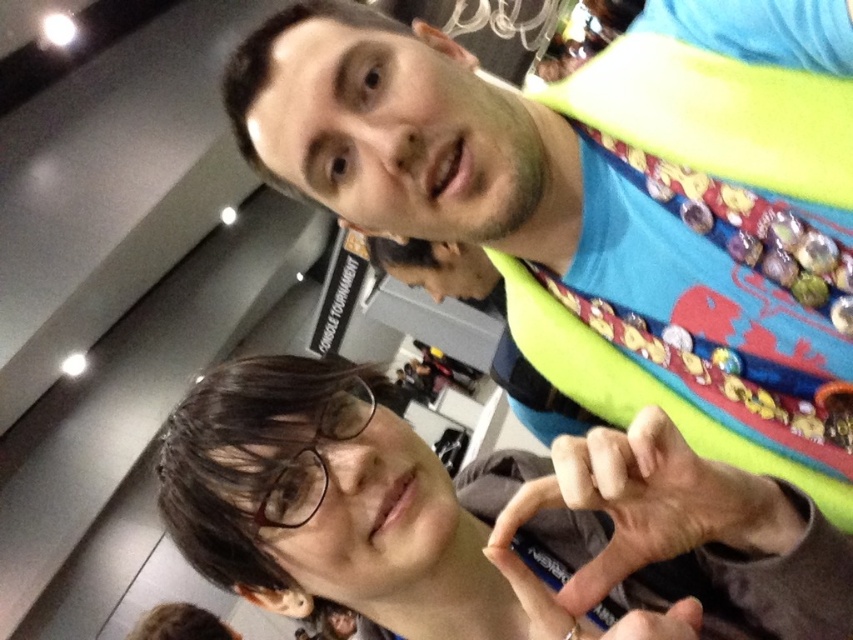
Question: Which of the following is the farthest from the observer?

Choices:
 (A) brown matte glasses at lower left
 (B) matte black pen at center
 (C) matte blue shirt at upper center

Answer: (C)

Question: Is matte blue shirt at upper center to the left of brown matte glasses at lower left from the viewer's perspective?

Choices:
 (A) yes
 (B) no

Answer: (B)

Question: Is brown matte glasses at lower left wider than matte black pen at center?

Choices:
 (A) yes
 (B) no

Answer: (A)

Question: Which object is positioned farthest from the brown matte glasses at lower left?

Choices:
 (A) matte blue shirt at upper center
 (B) matte black pen at center

Answer: (A)

Question: Does brown matte glasses at lower left appear under matte black pen at center?

Choices:
 (A) no
 (B) yes

Answer: (B)

Question: Which point is closer to the camera?

Choices:
 (A) matte black pen at center
 (B) brown matte glasses at lower left

Answer: (B)